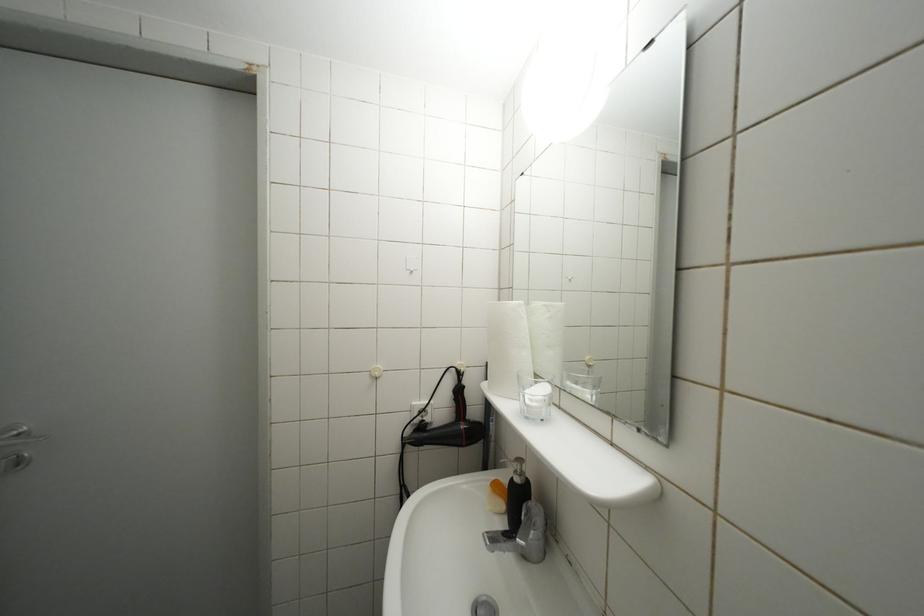
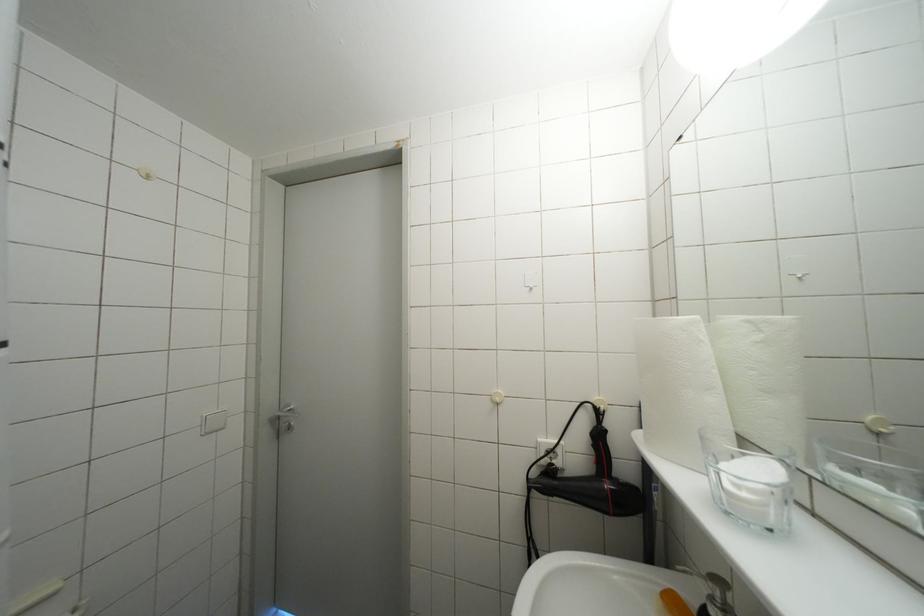
Question: The first image is from the beginning of the video and the second image is from the end. How did the camera likely rotate when shooting the video?

Choices:
 (A) Left
 (B) Right
 (C) Up
 (D) Down

Answer: (A)